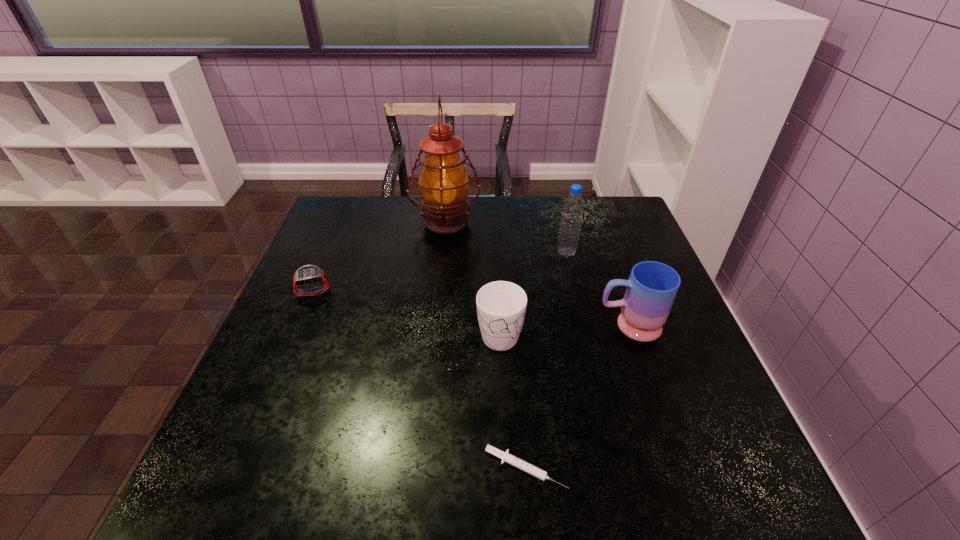
Find the location of a particular element. The height and width of the screenshot is (540, 960). object present at the far edge is located at coordinates (443, 183).

The height and width of the screenshot is (540, 960). In order to click on object located at the near edge in this screenshot , I will do pyautogui.click(x=505, y=456).

Image resolution: width=960 pixels, height=540 pixels. I want to click on object located in the left edge section of the desktop, so click(x=306, y=275).

Identify the location of object that is positioned at the right edge. This screenshot has width=960, height=540. (652, 287).

Identify the location of vacant space at the far edge. This screenshot has width=960, height=540. (377, 226).

Find the location of `free region at the left edge`. free region at the left edge is located at coordinates (319, 319).

Where is `free space at the right edge of the desktop`? free space at the right edge of the desktop is located at coordinates (660, 361).

Where is `vacant space at the far left corner of the desktop`? Image resolution: width=960 pixels, height=540 pixels. vacant space at the far left corner of the desktop is located at coordinates (325, 227).

Image resolution: width=960 pixels, height=540 pixels. In the image, there is a desktop. Find the location of `vacant space at the near left corner`. vacant space at the near left corner is located at coordinates (264, 475).

Locate an element on the screen. The image size is (960, 540). free space at the far right corner of the desktop is located at coordinates (632, 233).